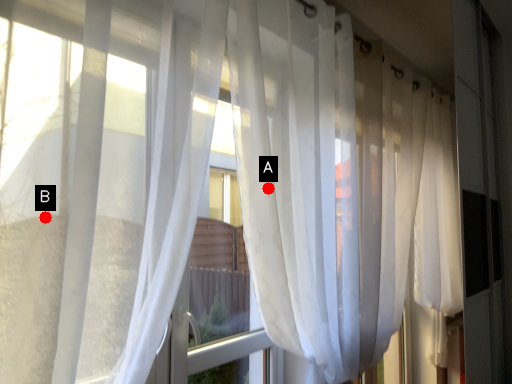
Question: Two points are circled on the image, labeled by A and B beside each circle. Which point appears closest to the camera in this image?

Choices:
 (A) A is closer
 (B) B is closer

Answer: (B)